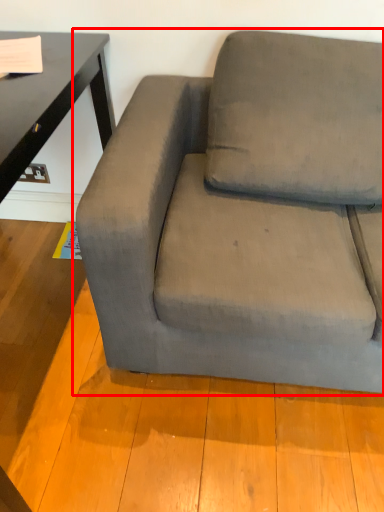
Question: Considering the relative positions of studio couch (annotated by the red box) and pillow in the image provided, where is studio couch (annotated by the red box) located with respect to the staircase?

Choices:
 (A) left
 (B) right

Answer: (A)